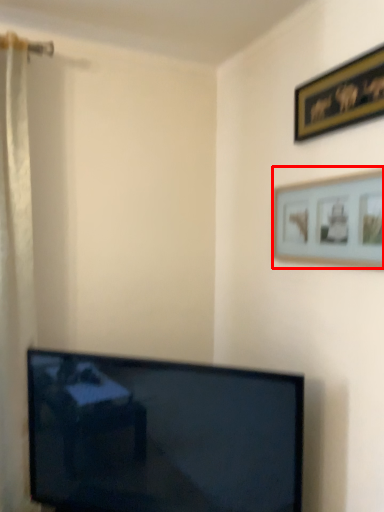
Question: In this image, where is picture frame (annotated by the red box) located relative to picture frame?

Choices:
 (A) right
 (B) left

Answer: (B)